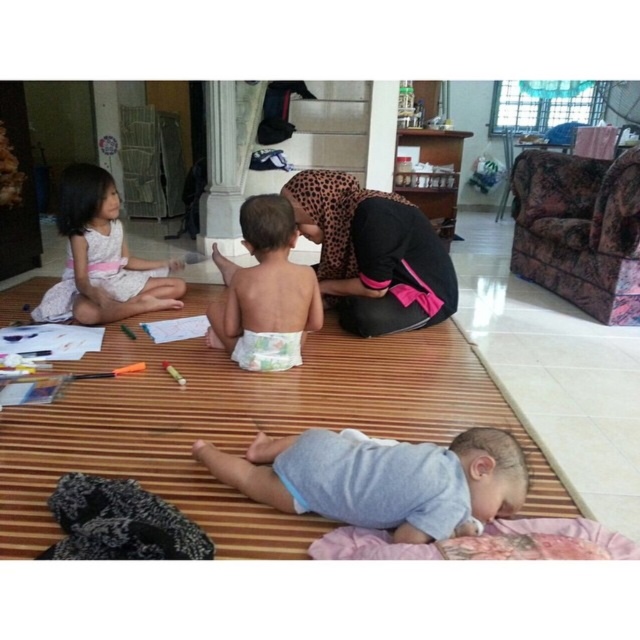
Between light blue fabric at center and light brown diaper at center, which one appears on the right side from the viewer's perspective?

light blue fabric at center is more to the right.

Does light blue fabric at center appear on the right side of light brown diaper at center?

Correct, you'll find light blue fabric at center to the right of light brown diaper at center.

Identify the location of light blue fabric at center. (380, 480).

In order to click on light blue fabric at center in this screenshot , I will do `click(380, 480)`.

Who is positioned more to the right, light blue fabric at center or white soft diaper at center?

light blue fabric at center

What do you see at coordinates (380, 480) in the screenshot? I see `light blue fabric at center` at bounding box center [380, 480].

Locate an element on the screen. light blue fabric at center is located at coordinates (380, 480).

Where is `light blue fabric at center`? The image size is (640, 640). light blue fabric at center is located at coordinates (380, 480).

Who is shorter, light blue fabric at center or white cotton dress at upper left?

light blue fabric at center

Does light blue fabric at center appear on the left side of white cotton dress at upper left?

Incorrect, light blue fabric at center is not on the left side of white cotton dress at upper left.

This screenshot has height=640, width=640. What do you see at coordinates (380, 480) in the screenshot?
I see `light blue fabric at center` at bounding box center [380, 480].

You are a GUI agent. You are given a task and a screenshot of the screen. Output one action in this format:
    pyautogui.click(x=<x>, y=<y>)
    Task: Click on the light blue fabric at center
    The image size is (640, 640).
    Given the screenshot: What is the action you would take?
    pyautogui.click(x=380, y=480)